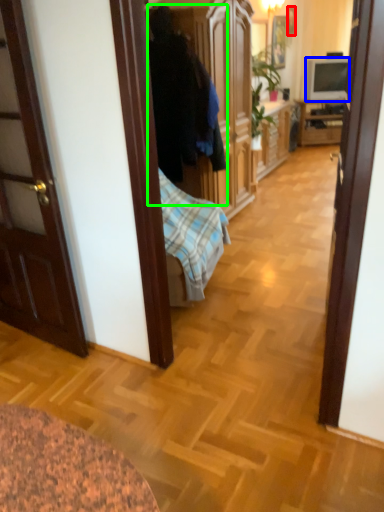
Question: Considering the real-world distances, which object is farthest from picture frame (highlighted by a red box)? television (highlighted by a blue box) or person (highlighted by a green box)?

Choices:
 (A) television
 (B) person

Answer: (B)